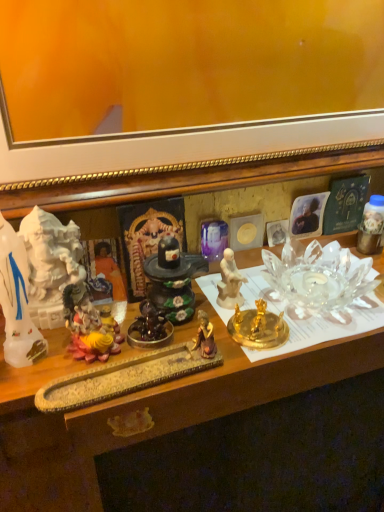
What do you see at coordinates (109, 267) in the screenshot?
I see `orange fabric at center, the first person from the left` at bounding box center [109, 267].

What is the approximate width of purple glass vase at center, positioned as the 5th toy in left-to-right order?

The width of purple glass vase at center, positioned as the 5th toy in left-to-right order, is 0.62 inches.

The width and height of the screenshot is (384, 512). What do you see at coordinates (89, 326) in the screenshot? I see `matte yellow statue at center, placed as the 2th toy when sorted from left to right` at bounding box center [89, 326].

Identify the location of matte yellow statue at center, placed as the 2th toy when sorted from left to right. (89, 326).

This screenshot has height=512, width=384. Find the location of `orange fabric at center, which is the 2th person in right-to-left order`. orange fabric at center, which is the 2th person in right-to-left order is located at coordinates (109, 267).

Is matte white statue at center, the first person viewed from the right, facing away from matte yellow statue at center, placed as the 2th toy when sorted from left to right?

That's not correct — matte white statue at center, the first person viewed from the right, is not looking away from matte yellow statue at center, placed as the 2th toy when sorted from left to right.

Are matte white statue at center, the 2th person viewed from the left, and matte yellow statue at center, placed as the 2th toy when sorted from left to right, far apart?

They are positioned close to each other.

What's the angular difference between matte white statue at center, the 2th person viewed from the left, and matte yellow statue at center, placed as the 5th toy when sorted from right to left,'s facing directions?

There is a 3.42-degree angle between the facing directions of matte white statue at center, the 2th person viewed from the left, and matte yellow statue at center, placed as the 5th toy when sorted from right to left.

Which of these two, matte white statue at center, the first person viewed from the right, or matte yellow statue at center, placed as the 5th toy when sorted from right to left, is thinner?

matte white statue at center, the first person viewed from the right.

Between point (382, 205) and point (21, 359), which one is positioned in front?

The point (21, 359) is in front.

Measure the distance from metallic gold figurine at right, acting as the first toy starting from the right, to white plastic statue at left, the first toy in the left-to-right sequence.

23.20 inches.

Looking at this image, from the image's perspective, is metallic gold figurine at right, positioned as the 6th toy in left-to-right order, under white plastic statue at left, the first toy in the left-to-right sequence?

No, from the image's perspective, metallic gold figurine at right, positioned as the 6th toy in left-to-right order, is not beneath white plastic statue at left, the first toy in the left-to-right sequence.

Is metallic gold figurine at right, positioned as the 6th toy in left-to-right order, shorter than white plastic statue at left, the sixth toy viewed from the right?

Indeed, metallic gold figurine at right, positioned as the 6th toy in left-to-right order, has a lesser height compared to white plastic statue at left, the sixth toy viewed from the right.

Can you tell me how much purple glass vase at center, marked as the second toy in a right-to-left arrangement, and metallic gold figurine at right, acting as the first toy starting from the right, differ in facing direction?

There is a 0.769-degree angle between the facing directions of purple glass vase at center, marked as the second toy in a right-to-left arrangement, and metallic gold figurine at right, acting as the first toy starting from the right.

Is purple glass vase at center, positioned as the 5th toy in left-to-right order, far from metallic gold figurine at right, acting as the first toy starting from the right?

purple glass vase at center, positioned as the 5th toy in left-to-right order, is near metallic gold figurine at right, acting as the first toy starting from the right, not far away.

Considering the positions of objects purple glass vase at center, positioned as the 5th toy in left-to-right order, and metallic gold figurine at right, positioned as the 6th toy in left-to-right order, in the image provided, who is more to the left, purple glass vase at center, positioned as the 5th toy in left-to-right order, or metallic gold figurine at right, positioned as the 6th toy in left-to-right order,?

purple glass vase at center, positioned as the 5th toy in left-to-right order, is more to the left.

Which of these two, purple glass vase at center, marked as the second toy in a right-to-left arrangement, or metallic gold figurine at right, acting as the first toy starting from the right, is bigger?

Bigger between the two is metallic gold figurine at right, acting as the first toy starting from the right.

Is purple glass vase at center, marked as the second toy in a right-to-left arrangement, taller or shorter than shiny black stone at center, which ranks as the third toy in right-to-left order?

In the image, purple glass vase at center, marked as the second toy in a right-to-left arrangement, appears to be shorter than shiny black stone at center, which ranks as the third toy in right-to-left order.

Consider the image. Considering the positions of objects purple glass vase at center, marked as the second toy in a right-to-left arrangement, and shiny black stone at center, which ranks as the third toy in right-to-left order, in the image provided, who is more to the left, purple glass vase at center, marked as the second toy in a right-to-left arrangement, or shiny black stone at center, which ranks as the third toy in right-to-left order,?

Positioned to the left is shiny black stone at center, which ranks as the third toy in right-to-left order.

Is purple glass vase at center, positioned as the 5th toy in left-to-right order, located outside shiny black stone at center, which ranks as the third toy in right-to-left order?

Yes, purple glass vase at center, positioned as the 5th toy in left-to-right order, is not within shiny black stone at center, which ranks as the third toy in right-to-left order.

From the image's perspective, is purple glass vase at center, positioned as the 5th toy in left-to-right order, under shiny dark brown statue at center, the 3th toy viewed from the left?

Actually, purple glass vase at center, positioned as the 5th toy in left-to-right order, appears above shiny dark brown statue at center, the 3th toy viewed from the left, in the image.

Could you tell me if purple glass vase at center, marked as the second toy in a right-to-left arrangement, is facing shiny dark brown statue at center, the 3th toy viewed from the left?

No.

Is purple glass vase at center, positioned as the 5th toy in left-to-right order, thinner than shiny dark brown statue at center, arranged as the 4th toy when viewed from the right?

Yes, purple glass vase at center, positioned as the 5th toy in left-to-right order, is thinner than shiny dark brown statue at center, arranged as the 4th toy when viewed from the right.

Is the surface of purple glass vase at center, positioned as the 5th toy in left-to-right order, in direct contact with shiny dark brown statue at center, arranged as the 4th toy when viewed from the right?

There is a gap between purple glass vase at center, positioned as the 5th toy in left-to-right order, and shiny dark brown statue at center, arranged as the 4th toy when viewed from the right.

From a real-world perspective, which is physically below, white plastic statue at left, the sixth toy viewed from the right, or matte white statue at center, the first person viewed from the right?

From a 3D spatial view, matte white statue at center, the first person viewed from the right, is below.

Is white plastic statue at left, the first toy in the left-to-right sequence, outside of matte white statue at center, the 2th person viewed from the left?

Absolutely, white plastic statue at left, the first toy in the left-to-right sequence, is external to matte white statue at center, the 2th person viewed from the left.

Considering the points (6, 321) and (226, 260), which point is behind, point (6, 321) or point (226, 260)?

The point (226, 260) is more distant.

Is white plastic statue at left, the first toy in the left-to-right sequence, not near matte white statue at center, the 2th person viewed from the left?

white plastic statue at left, the first toy in the left-to-right sequence, is actually quite close to matte white statue at center, the 2th person viewed from the left.

Is gold metallic tray at center to the right of matte white statue at center, the 2th person viewed from the left, from the viewer's perspective?

Yes, gold metallic tray at center is to the right of matte white statue at center, the 2th person viewed from the left.

Is gold metallic tray at center smaller than matte white statue at center, the first person viewed from the right?

Actually, gold metallic tray at center might be larger than matte white statue at center, the first person viewed from the right.

Does gold metallic tray at center contain matte white statue at center, the 2th person viewed from the left?

No, matte white statue at center, the 2th person viewed from the left, is not a part of gold metallic tray at center.

Between gold metallic tray at center and matte white statue at center, the first person viewed from the right, which one has less height?

With less height is matte white statue at center, the first person viewed from the right.

In order to click on the 3rd toy in front of the matte white statue at center, the first person viewed from the right, starting your count from the anchor in this screenshot , I will do `click(89, 326)`.

I want to click on toy located above the metallic gold figurine at right, positioned as the 6th toy in left-to-right order (from a real-world perspective), so click(17, 301).

Considering their positions, is matte white statue at center, the 2th person viewed from the left, positioned further to orange fabric at center, the first person from the left, than purple glass vase at center, marked as the second toy in a right-to-left arrangement?

purple glass vase at center, marked as the second toy in a right-to-left arrangement.

Looking at the image, which one is located closer to white plastic statue at left, the sixth toy viewed from the right, matte white statue at center, the first person viewed from the right, or shiny dark brown statue at center, the 3th toy viewed from the left?

Based on the image, shiny dark brown statue at center, the 3th toy viewed from the left, appears to be nearer to white plastic statue at left, the sixth toy viewed from the right.

Estimate the real-world distances between objects in this image. Which object is further from metallic gold figurine at right, positioned as the 6th toy in left-to-right order, purple glass vase at center, marked as the second toy in a right-to-left arrangement, or orange fabric at center, which is the 2th person in right-to-left order?

orange fabric at center, which is the 2th person in right-to-left order.

From the image, which object appears to be farther from metallic gold figurine at right, positioned as the 6th toy in left-to-right order, gold metallic tray at center or orange fabric at center, the first person from the left?

Among the two, orange fabric at center, the first person from the left, is located further to metallic gold figurine at right, positioned as the 6th toy in left-to-right order.

From the image, which object appears to be nearer to gold metallic candle holder at center, metallic gold figurine at right, acting as the first toy starting from the right, or shiny dark brown statue at center, the 3th toy viewed from the left?

Based on the image, shiny dark brown statue at center, the 3th toy viewed from the left, appears to be nearer to gold metallic candle holder at center.

Which object lies nearer to the anchor point shiny dark brown statue at center, arranged as the 4th toy when viewed from the right, metallic gold figurine at right, acting as the first toy starting from the right, or matte white statue at center, the first person viewed from the right?

Based on the image, matte white statue at center, the first person viewed from the right, appears to be nearer to shiny dark brown statue at center, arranged as the 4th toy when viewed from the right.

When comparing their distances from metallic gold figurine at right, acting as the first toy starting from the right, does matte yellow statue at center, placed as the 2th toy when sorted from left to right, or shiny dark brown statue at center, arranged as the 4th toy when viewed from the right, seem further?

Among the two, matte yellow statue at center, placed as the 2th toy when sorted from left to right, is located further to metallic gold figurine at right, acting as the first toy starting from the right.

Looking at this image, estimate the real-world distances between objects in this image. Which object is further from gold metallic candle holder at center, purple glass vase at center, marked as the second toy in a right-to-left arrangement, or orange fabric at center, which is the 2th person in right-to-left order?

Based on the image, orange fabric at center, which is the 2th person in right-to-left order, appears to be further to gold metallic candle holder at center.

Where is `candle holder between white plastic statue at left, the sixth toy viewed from the right, and gold metallic tray at center, in the vertical direction`? The height and width of the screenshot is (512, 384). candle holder between white plastic statue at left, the sixth toy viewed from the right, and gold metallic tray at center, in the vertical direction is located at coordinates (258, 327).

Where is `person located between matte yellow statue at center, placed as the 2th toy when sorted from left to right, and gold metallic candle holder at center in the left-right direction`? person located between matte yellow statue at center, placed as the 2th toy when sorted from left to right, and gold metallic candle holder at center in the left-right direction is located at coordinates (229, 282).

This screenshot has width=384, height=512. I want to click on person between shiny dark brown statue at center, the 3th toy viewed from the left, and gold metallic candle holder at center, so click(x=229, y=282).

This screenshot has width=384, height=512. I want to click on candle holder between matte white statue at center, the first person viewed from the right, and gold metallic tray at center in the up-down direction, so click(x=258, y=327).